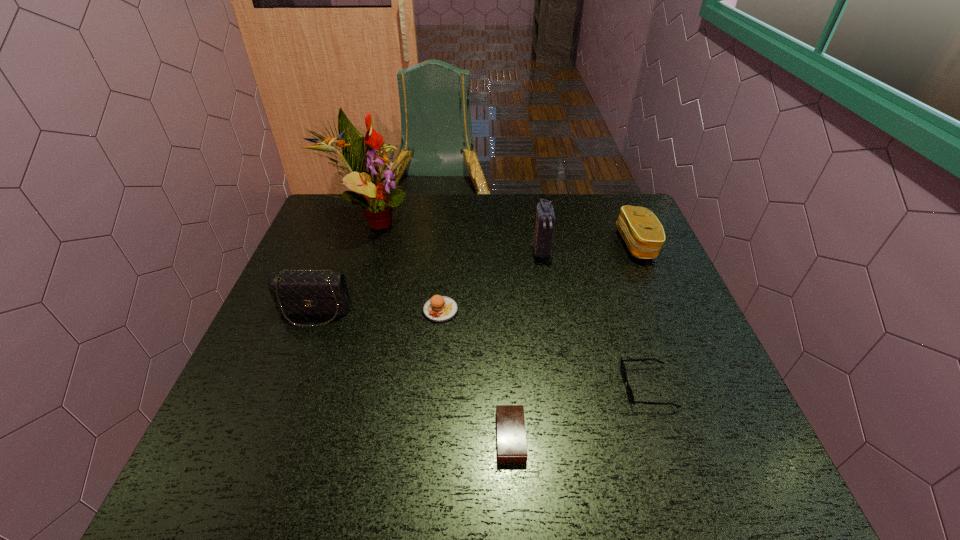
Find the location of `the sixth farthest object`. the sixth farthest object is located at coordinates (629, 391).

The height and width of the screenshot is (540, 960). Identify the location of the fourth object from right to left. click(x=510, y=424).

Identify the location of the nearest object. The image size is (960, 540). pos(510,424).

Locate an element on the screen. vacant region located 0.060m on the front-facing side of the bouquet is located at coordinates (433, 220).

At what (x,y) coordinates should I click in order to perform the action: click on vacant area situated 0.150m with the zip open on the second clutch bag from left to right. Please return your answer as a coordinate pair (x, y). This screenshot has height=540, width=960. Looking at the image, I should click on (549, 299).

This screenshot has height=540, width=960. I want to click on free location located on the front flap of the third tallest object, so pos(290,375).

Locate an element on the screen. This screenshot has width=960, height=540. vacant space situated on the zipper side of the rightmost clutch bag is located at coordinates (544, 244).

Where is `vacant point located 0.180m on the zipper side of the rightmost clutch bag`? Image resolution: width=960 pixels, height=540 pixels. vacant point located 0.180m on the zipper side of the rightmost clutch bag is located at coordinates (558, 244).

You are a GUI agent. You are given a task and a screenshot of the screen. Output one action in this format:
    pyautogui.click(x=<x>, y=<y>)
    Task: Click on the blank space located on the zipper side of the rightmost clutch bag
    The image size is (960, 540).
    Given the screenshot: What is the action you would take?
    pyautogui.click(x=517, y=244)

At what (x,y) coordinates should I click in order to perform the action: click on vacant space located 0.090m on the front of the patty. Please return your answer as a coordinate pair (x, y). This screenshot has height=540, width=960. Looking at the image, I should click on (437, 353).